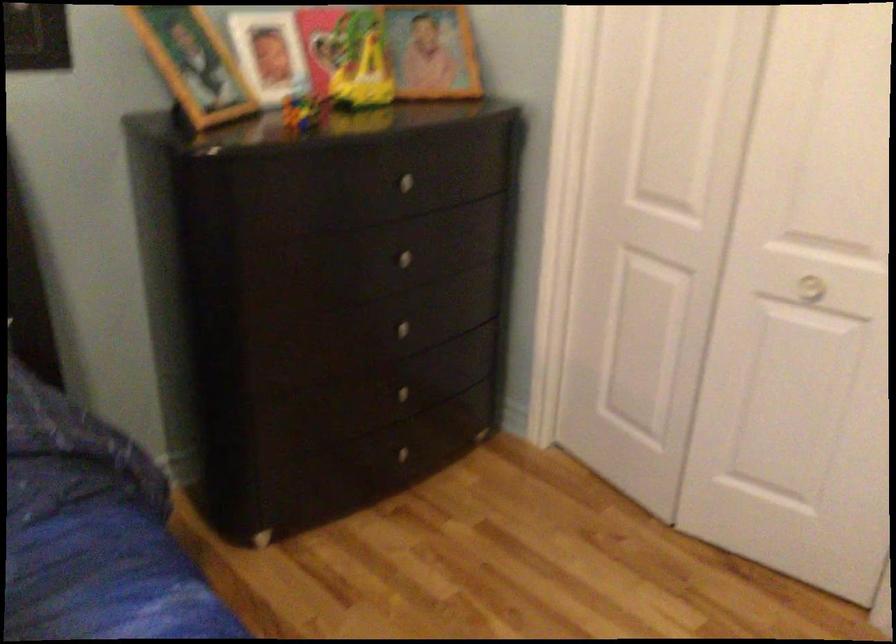
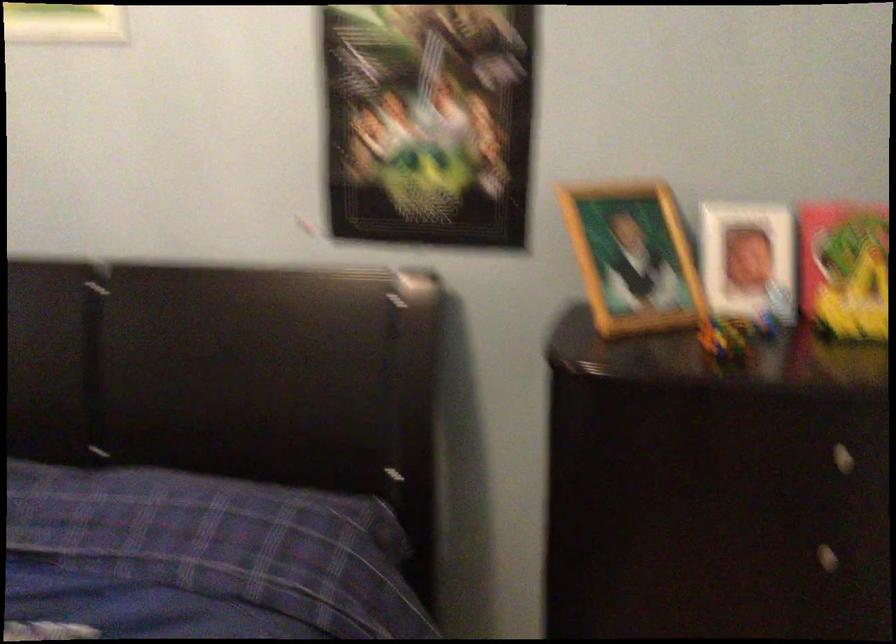
Find the pixel in the second image that matches point (408, 187) in the first image.

(840, 458)